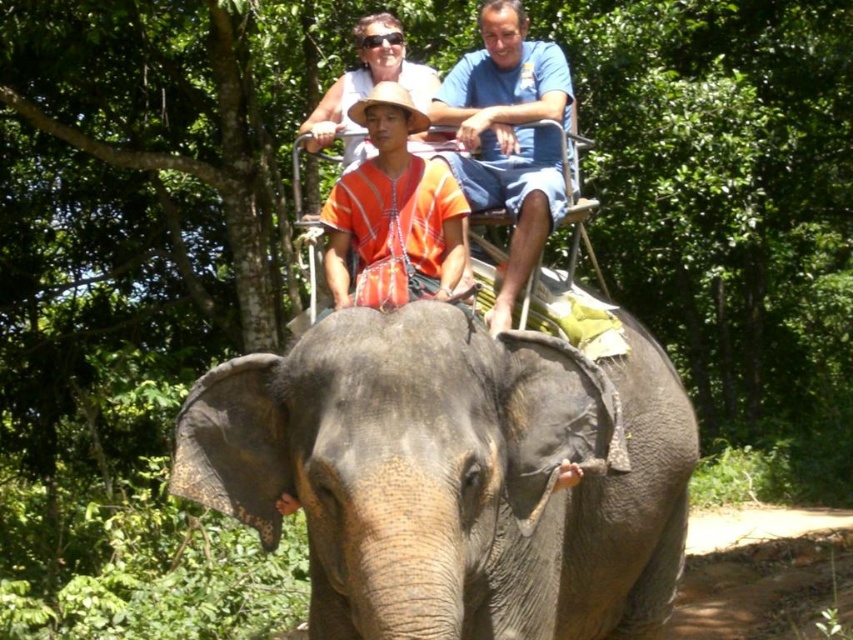
You are a photographer standing in the forest and want to take a photo of the gray textured elephant at center and the blue cotton shirt at upper center. Which object should you focus on first if you want to capture both in the same frame without moving your camera?

The gray textured elephant at center is shorter than the blue cotton shirt at upper center, so you should focus on the blue cotton shirt at upper center first to ensure both are in the frame.

You are a photographer trying to capture a clear photo of the blue cotton shirt at upper center. However, the gray textured elephant at center is blocking your view. Can you move to the right to get a better shot?

Yes, since the gray textured elephant at center is to the left of the blue cotton shirt at upper center, moving to the right would allow you to position yourself around the elephant and get an unobstructed view of the blue cotton shirt at upper center.